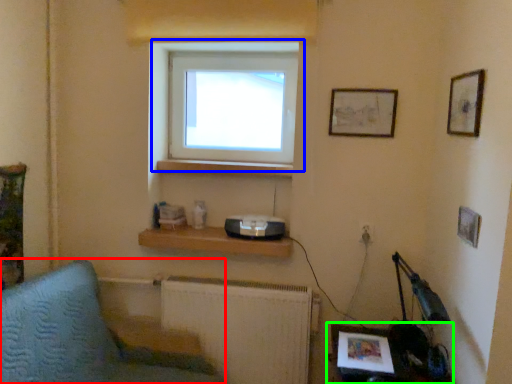
Question: Which object is positioned closest to furniture (highlighted by a red box)? Select from window (highlighted by a blue box) and table (highlighted by a green box).

Choices:
 (A) window
 (B) table

Answer: (A)